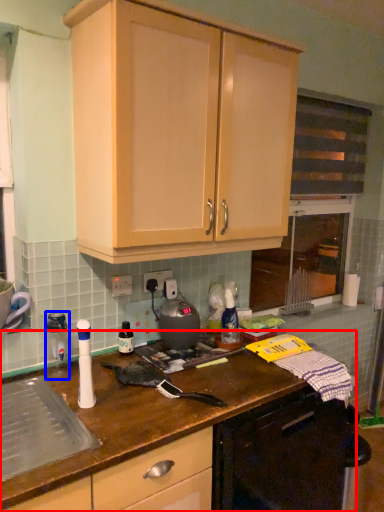
Question: Which point is further to the camera, countertop (highlighted by a red box) or appliance (highlighted by a blue box)?

Choices:
 (A) countertop
 (B) appliance

Answer: (B)